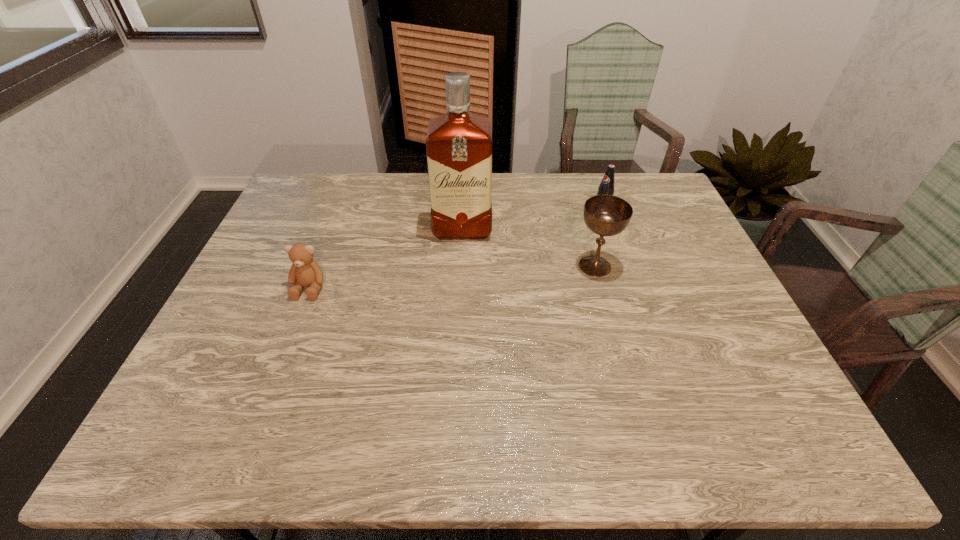
In the image, there is a desktop. Identify the location of vacant area at the right edge. (750, 357).

This screenshot has height=540, width=960. I want to click on free point between the second farthest object and the shortest object, so click(x=386, y=259).

I want to click on free space between the chalice and the teddy bear, so click(x=452, y=277).

Where is `free spot between the teddy bear and the second shortest object`? free spot between the teddy bear and the second shortest object is located at coordinates (455, 251).

Locate an element on the screen. The width and height of the screenshot is (960, 540). blank region between the leftmost object and the second object from left to right is located at coordinates (386, 259).

Locate an element on the screen. free space that is in between the second farthest object and the third tallest object is located at coordinates (532, 222).

Locate an element on the screen. free area in between the liquor and the leftmost object is located at coordinates (386, 259).

Find the location of `unoccupied position between the chalice and the third object from right to left`. unoccupied position between the chalice and the third object from right to left is located at coordinates click(x=529, y=248).

Image resolution: width=960 pixels, height=540 pixels. I want to click on the second closest object to the teddy bear, so click(x=606, y=215).

Locate an element on the screen. The width and height of the screenshot is (960, 540). object that is the closest one to the teddy bear is located at coordinates (459, 144).